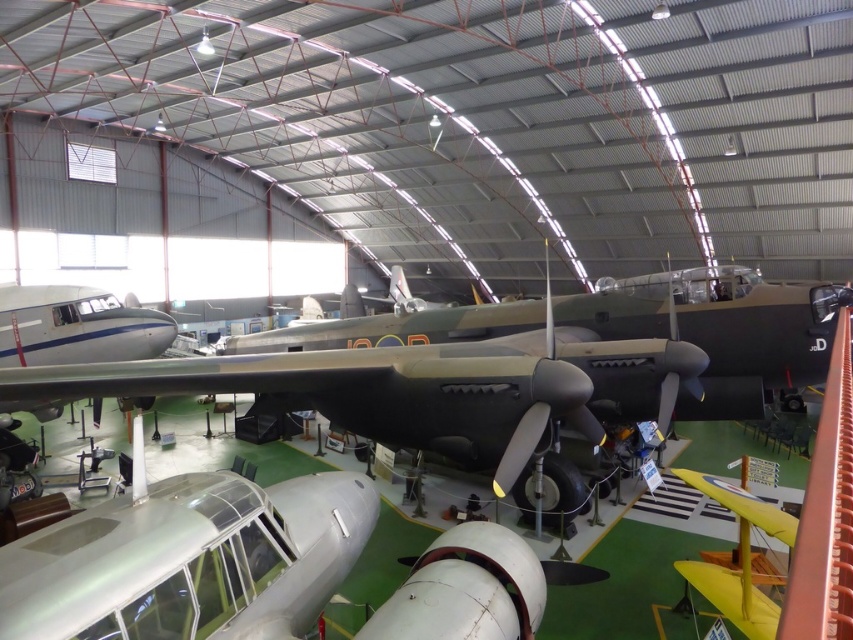
Question: Which point is closer to the camera?

Choices:
 (A) (662, 385)
 (B) (248, 589)
 (C) (727, 616)

Answer: (B)

Question: Considering the relative positions of camouflage paint airplane at center and yellow matte airplane at lower right in the image provided, where is camouflage paint airplane at center located with respect to yellow matte airplane at lower right?

Choices:
 (A) above
 (B) below

Answer: (A)

Question: Which of the following is the closest to the observer?

Choices:
 (A) (537, 353)
 (B) (730, 508)

Answer: (B)

Question: Which object is the farthest from the metallic silver airplane at center?

Choices:
 (A) camouflage paint airplane at center
 (B) yellow matte airplane at lower right

Answer: (B)

Question: Does metallic silver airplane at center lie in front of yellow matte airplane at lower right?

Choices:
 (A) no
 (B) yes

Answer: (B)

Question: Is camouflage paint airplane at center thinner than yellow matte airplane at lower right?

Choices:
 (A) no
 (B) yes

Answer: (A)